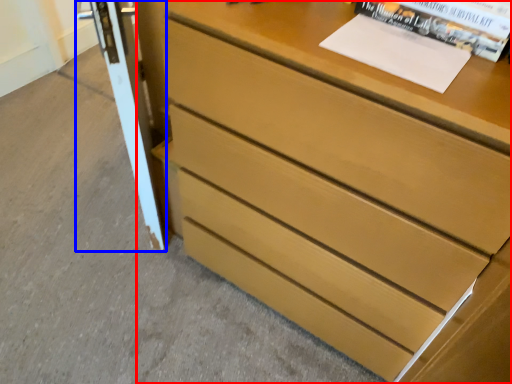
Question: Which point is further to the camera, chest of drawers (highlighted by a red box) or screen door (highlighted by a blue box)?

Choices:
 (A) chest of drawers
 (B) screen door

Answer: (B)